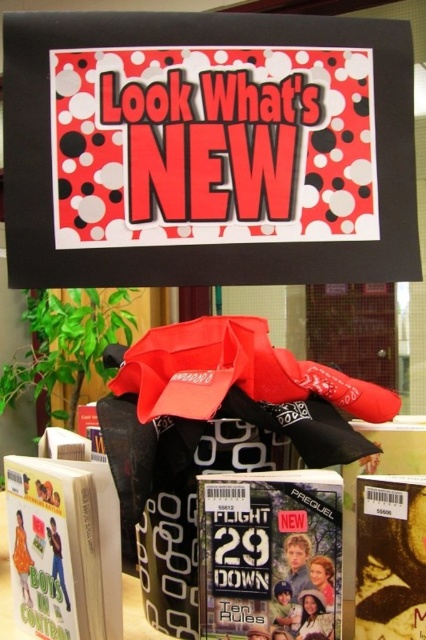
Question: Where is matte paper magazine at center located in relation to matte brown magazine at lower right in the image?

Choices:
 (A) left
 (B) right

Answer: (A)

Question: Among these points, which one is farthest from the camera?

Choices:
 (A) (89, 464)
 (B) (313, 620)
 (C) (360, 577)

Answer: (A)

Question: Is matte cardboard magazine at lower left smaller than matte brown magazine at lower right?

Choices:
 (A) no
 (B) yes

Answer: (A)

Question: Is matte paper magazine at center thinner than matte cardboard magazine at lower left?

Choices:
 (A) no
 (B) yes

Answer: (B)

Question: Which object appears farthest from the camera in this image?

Choices:
 (A) matte brown magazine at lower right
 (B) matte cardboard magazine at lower left
 (C) matte paper magazine at center

Answer: (B)

Question: Which object appears farthest from the camera in this image?

Choices:
 (A) matte paper magazine at center
 (B) matte cardboard magazine at lower left
 (C) matte brown magazine at lower right

Answer: (B)